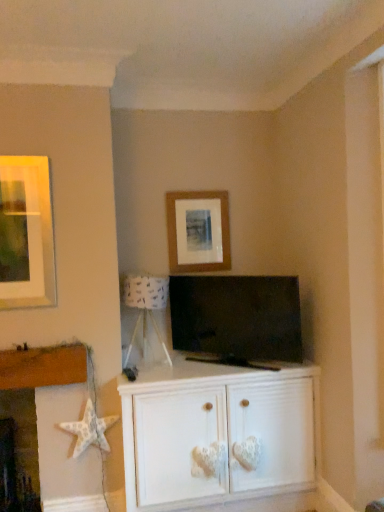
I want to click on white textured star at lower left, so click(x=43, y=367).

Image resolution: width=384 pixels, height=512 pixels. What do you see at coordinates (198, 231) in the screenshot?
I see `wooden picture frame at center` at bounding box center [198, 231].

This screenshot has height=512, width=384. What do you see at coordinates (146, 306) in the screenshot? I see `white paper lampshade at center` at bounding box center [146, 306].

Locate an element on the screen. white painted wood cabinet at center is located at coordinates (217, 432).

The image size is (384, 512). I want to click on white textured star at lower left, so click(43, 367).

Is white paper lampshade at center wider than matte black tv at center?

Yes, white paper lampshade at center is wider than matte black tv at center.

Is white paper lampshade at center taller than matte black tv at center?

In fact, white paper lampshade at center may be shorter than matte black tv at center.

From a real-world perspective, is white paper lampshade at center positioned above or below matte black tv at center?

From a real-world perspective, white paper lampshade at center is physically above matte black tv at center.

Is white paper lampshade at center with matte black tv at center?

No, white paper lampshade at center is not touching matte black tv at center.

What's the angular difference between white fabric starfish at lower left and white paper lampshade at center's facing directions?

There is a 0.809-degree angle between the facing directions of white fabric starfish at lower left and white paper lampshade at center.

From a real-world perspective, is white fabric starfish at lower left on top of white paper lampshade at center?

Actually, white fabric starfish at lower left is physically below white paper lampshade at center in the real world.

Which of these two, white fabric starfish at lower left or white paper lampshade at center, is bigger?

Bigger between the two is white paper lampshade at center.

Is white fabric starfish at lower left in contact with white paper lampshade at center?

No, white fabric starfish at lower left is not with white paper lampshade at center.

How many degrees apart are the facing directions of matte black tv at center and wooden picture frame at center?

The facing directions of matte black tv at center and wooden picture frame at center are 39 degrees apart.

Is matte black tv at center positioned far away from wooden picture frame at center?

Actually, matte black tv at center and wooden picture frame at center are a little close together.

Is the position of matte black tv at center less distant than that of wooden picture frame at center?

That is True.

From the image's perspective, which is above, white paper lampshade at center or wooden picture frame at center?

From the image's view, wooden picture frame at center is above.

Which object is wider, white paper lampshade at center or wooden picture frame at center?

white paper lampshade at center is wider.

Is white paper lampshade at center oriented towards wooden picture frame at center?

No.

Is white textured star at lower left closer to camera compared to matte black tv at center?

No, the depth of white textured star at lower left is greater than that of matte black tv at center.

Can you tell me how much white textured star at lower left and matte black tv at center differ in facing direction?

They differ by 40.5 degrees in their facing directions.

Is white textured star at lower left outside of matte black tv at center?

white textured star at lower left lies outside matte black tv at center's area.

Are white fabric starfish at lower left and wooden picture frame at center located far from each other?

white fabric starfish at lower left is positioned a significant distance from wooden picture frame at center.

How different are the orientations of white fabric starfish at lower left and wooden picture frame at center in degrees?

2.71 degrees separate the facing orientations of white fabric starfish at lower left and wooden picture frame at center.

Where is `starfish that appears in front of the wooden picture frame at center`? This screenshot has height=512, width=384. starfish that appears in front of the wooden picture frame at center is located at coordinates (89, 430).

Is white fabric starfish at lower left looking in the opposite direction of wooden picture frame at center?

That's not correct — white fabric starfish at lower left is not looking away from wooden picture frame at center.

Is white textured star at lower left in front of or behind wooden picture frame at center in the image?

Visually, white textured star at lower left is located in front of wooden picture frame at center.

Is white textured star at lower left far from wooden picture frame at center?

white textured star at lower left is positioned a significant distance from wooden picture frame at center.

Is white textured star at lower left oriented away from wooden picture frame at center?

white textured star at lower left is not turned away from wooden picture frame at center.

Which point is more forward, (24, 362) or (205, 201)?

Positioned in front is point (24, 362).

Locate an element on the screen. lamp behind the matte black tv at center is located at coordinates (146, 306).

At what (x,y) coordinates should I click in order to perform the action: click on lamp above the white fabric starfish at lower left (from a real-world perspective). Please return your answer as a coordinate pair (x, y). This screenshot has width=384, height=512. Looking at the image, I should click on (146, 306).

Based on their spatial positions, is white painted wood cabinet at center or white textured star at lower left further from white paper lampshade at center?

white painted wood cabinet at center is positioned further to the anchor white paper lampshade at center.

From the image, which object appears to be farther from white painted wood cabinet at center, white textured star at lower left or white paper lampshade at center?

Based on the image, white textured star at lower left appears to be further to white painted wood cabinet at center.

When comparing their distances from white painted wood cabinet at center, does matte black tv at center or wooden picture frame at center seem closer?

matte black tv at center lies closer to white painted wood cabinet at center than the other object.

From the image, which object appears to be nearer to matte black tv at center, wooden picture frame at center or white paper lampshade at center?

white paper lampshade at center is positioned closer to the anchor matte black tv at center.

Based on their spatial positions, is white fabric starfish at lower left or white paper lampshade at center closer to white textured star at lower left?

white fabric starfish at lower left.

Based on their spatial positions, is white painted wood cabinet at center or wooden picture frame at center further from matte black tv at center?

Based on the image, white painted wood cabinet at center appears to be further to matte black tv at center.

Estimate the real-world distances between objects in this image. Which object is further from wooden picture frame at center, white textured star at lower left or white paper lampshade at center?

white textured star at lower left.

From the image, which object appears to be farther from wooden picture frame at center, matte black tv at center or white fabric starfish at lower left?

Based on the image, white fabric starfish at lower left appears to be further to wooden picture frame at center.

The image size is (384, 512). Identify the location of starfish between white textured star at lower left and white painted wood cabinet at center. (89, 430).

The width and height of the screenshot is (384, 512). I want to click on television between wooden picture frame at center and white painted wood cabinet at center in the vertical direction, so click(x=237, y=316).

This screenshot has height=512, width=384. I want to click on lamp that lies between wooden picture frame at center and white textured star at lower left from top to bottom, so click(146, 306).

This screenshot has width=384, height=512. Identify the location of television that lies between wooden picture frame at center and white fabric starfish at lower left from top to bottom. (237, 316).